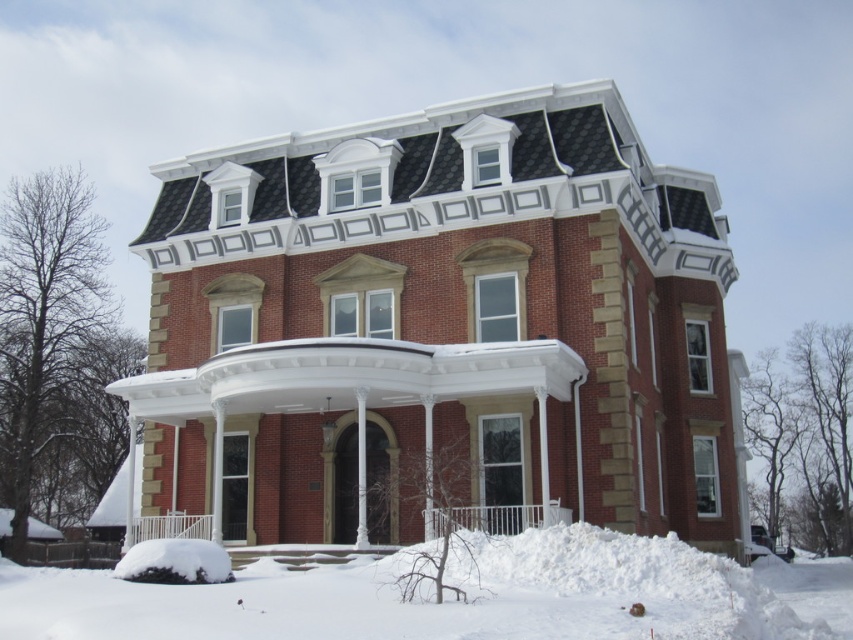
Question: Is white fluffy snow at lower center thinner than white painted wood porch at center?

Choices:
 (A) yes
 (B) no

Answer: (B)

Question: In this image, where is white fluffy snow at lower center located relative to white painted wood porch at center?

Choices:
 (A) right
 (B) left

Answer: (A)

Question: Is white fluffy snow at lower center below white painted wood porch at center?

Choices:
 (A) yes
 (B) no

Answer: (A)

Question: Among these points, which one is farthest from the camera?

Choices:
 (A) (514, 522)
 (B) (672, 561)

Answer: (A)

Question: Which of the following is the farthest from the observer?

Choices:
 (A) white painted wood porch at center
 (B) white fluffy snow at lower center

Answer: (A)